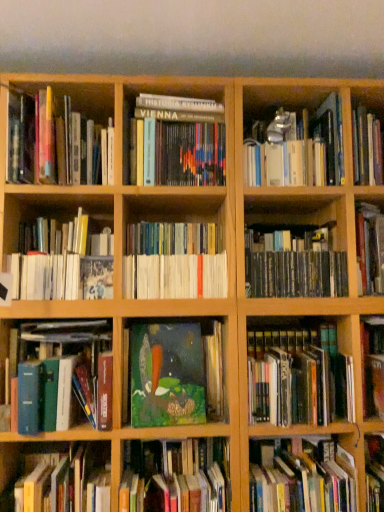
Question: Does hardcover book at lower right, arranged as the 1th book when ordered from the bottom, have a greater height compared to hardcover book at left, the 6th book in the bottom-to-top sequence?

Choices:
 (A) no
 (B) yes

Answer: (A)

Question: Is hardcover book at lower right, arranged as the twelfth book when viewed from the top, at the right side of hardcover book at left, the 6th book in the bottom-to-top sequence?

Choices:
 (A) yes
 (B) no

Answer: (A)

Question: Is hardcover book at left, which is the seventh book in top-to-bottom order, surrounded by hardcover book at lower right, arranged as the 1th book when ordered from the bottom?

Choices:
 (A) yes
 (B) no

Answer: (B)

Question: Can you confirm if hardcover book at lower right, arranged as the twelfth book when viewed from the top, is positioned to the left of hardcover book at left, the 6th book in the bottom-to-top sequence?

Choices:
 (A) yes
 (B) no

Answer: (B)

Question: Does hardcover book at lower right, arranged as the 1th book when ordered from the bottom, turn towards hardcover book at left, the 6th book in the bottom-to-top sequence?

Choices:
 (A) yes
 (B) no

Answer: (B)

Question: Can you confirm if hardcover book at lower right, arranged as the twelfth book when viewed from the top, is bigger than hardcover book at left, which is the seventh book in top-to-bottom order?

Choices:
 (A) yes
 (B) no

Answer: (B)

Question: Is hardcover book at upper right, the first book from the top, at the back of hardcover book at left, which is the seventh book in top-to-bottom order?

Choices:
 (A) no
 (B) yes

Answer: (A)

Question: From a real-world perspective, is hardcover book at left, the 6th book in the bottom-to-top sequence, physically below hardcover book at upper right, which is the twelfth book in bottom-to-top order?

Choices:
 (A) yes
 (B) no

Answer: (A)

Question: From a real-world perspective, is hardcover book at left, the 6th book in the bottom-to-top sequence, over hardcover book at upper right, the first book from the top?

Choices:
 (A) no
 (B) yes

Answer: (A)

Question: Is hardcover book at left, which is the seventh book in top-to-bottom order, shorter than hardcover book at upper right, which is the twelfth book in bottom-to-top order?

Choices:
 (A) yes
 (B) no

Answer: (A)

Question: From the image's perspective, is hardcover book at left, which is the seventh book in top-to-bottom order, on hardcover book at upper right, the first book from the top?

Choices:
 (A) yes
 (B) no

Answer: (B)

Question: Is hardcover book at left, which is the seventh book in top-to-bottom order, facing towards hardcover book at upper right, the first book from the top?

Choices:
 (A) no
 (B) yes

Answer: (A)

Question: Can you confirm if green matte book at center, the tenth book viewed from the top, is positioned to the right of hardcover book at upper right, which is the twelfth book in bottom-to-top order?

Choices:
 (A) no
 (B) yes

Answer: (A)